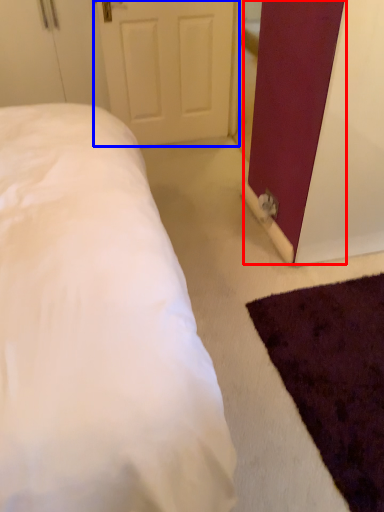
Question: Which object appears closest to the camera in this image, barn door (highlighted by a red box) or door (highlighted by a blue box)?

Choices:
 (A) barn door
 (B) door

Answer: (A)